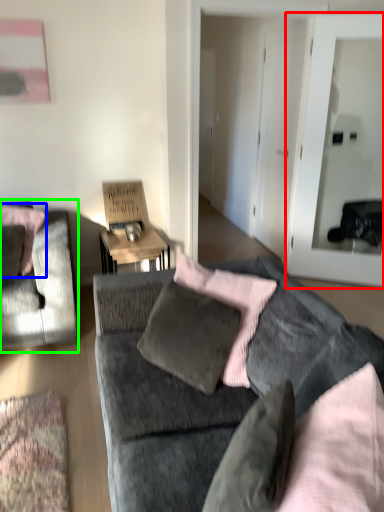
Question: Which object is positioned closest to glass door (highlighted by a red box)? Select from pillow (highlighted by a blue box) and chair (highlighted by a green box).

Choices:
 (A) pillow
 (B) chair

Answer: (B)